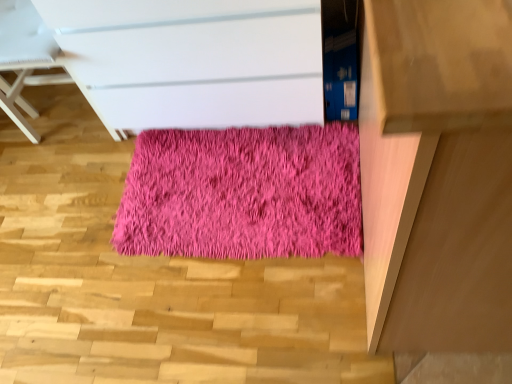
Question: Considering the relative positions of light brown wooden table at right and shaggy pink rug at center in the image provided, is light brown wooden table at right in front of shaggy pink rug at center?

Choices:
 (A) no
 (B) yes

Answer: (B)

Question: Could you tell me if light brown wooden table at right is turned towards shaggy pink rug at center?

Choices:
 (A) yes
 (B) no

Answer: (B)

Question: Is light brown wooden table at right positioned behind shaggy pink rug at center?

Choices:
 (A) yes
 (B) no

Answer: (B)

Question: From a real-world perspective, is light brown wooden table at right over shaggy pink rug at center?

Choices:
 (A) yes
 (B) no

Answer: (A)

Question: Is light brown wooden table at right outside of shaggy pink rug at center?

Choices:
 (A) yes
 (B) no

Answer: (A)

Question: Can you confirm if light brown wooden table at right is shorter than shaggy pink rug at center?

Choices:
 (A) no
 (B) yes

Answer: (A)

Question: Can you confirm if pink fluffy rug at center is thinner than shaggy pink rug at center?

Choices:
 (A) no
 (B) yes

Answer: (A)

Question: Is pink fluffy rug at center closer to the viewer compared to shaggy pink rug at center?

Choices:
 (A) no
 (B) yes

Answer: (B)

Question: Considering the relative sizes of pink fluffy rug at center and shaggy pink rug at center in the image provided, is pink fluffy rug at center smaller than shaggy pink rug at center?

Choices:
 (A) yes
 (B) no

Answer: (B)

Question: Does pink fluffy rug at center have a greater height compared to shaggy pink rug at center?

Choices:
 (A) no
 (B) yes

Answer: (B)

Question: Does pink fluffy rug at center have a greater width compared to shaggy pink rug at center?

Choices:
 (A) yes
 (B) no

Answer: (A)

Question: Is pink fluffy rug at center next to shaggy pink rug at center?

Choices:
 (A) yes
 (B) no

Answer: (B)

Question: Is pink fluffy rug at center facing towards light brown wooden table at right?

Choices:
 (A) yes
 (B) no

Answer: (A)